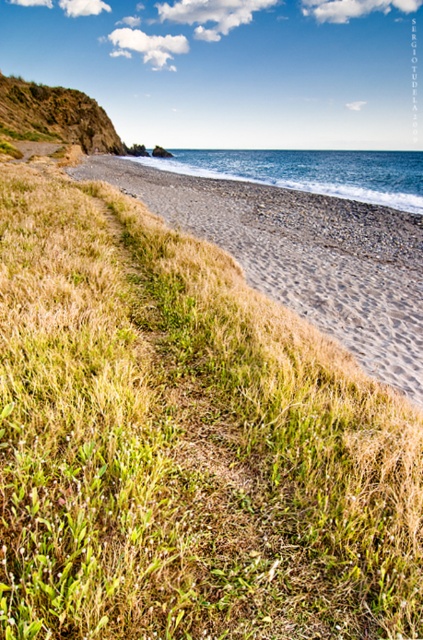
Which of these two, light brown sandy beach at lower right or green grassy cliff at upper left, stands taller?

With more height is green grassy cliff at upper left.

Between light brown sandy beach at lower right and green grassy cliff at upper left, which one is positioned higher?

green grassy cliff at upper left is above.

Which is behind, point (340, 252) or point (87, 99)?

Positioned behind is point (87, 99).

Locate an element on the screen. This screenshot has width=423, height=640. light brown sandy beach at lower right is located at coordinates click(304, 256).

Between light brown sandy beach at lower right and blue water at beach right, which one appears on the right side from the viewer's perspective?

blue water at beach right is more to the right.

Is light brown sandy beach at lower right positioned in front of blue water at beach right?

Yes, light brown sandy beach at lower right is in front of blue water at beach right.

You are a GUI agent. You are given a task and a screenshot of the screen. Output one action in this format:
    pyautogui.click(x=<x>, y=<y>)
    Task: Click on the light brown sandy beach at lower right
    
    Given the screenshot: What is the action you would take?
    pyautogui.click(x=304, y=256)

Does blue water at beach right appear under green grassy cliff at upper left?

No, blue water at beach right is not below green grassy cliff at upper left.

Does point (371, 160) come behind point (112, 141)?

Yes, point (371, 160) is farther from viewer.

Who is more forward, (351, 182) or (41, 99)?

Point (351, 182) is more forward.

Where is `blue water at beach right`? This screenshot has height=640, width=423. blue water at beach right is located at coordinates click(313, 172).